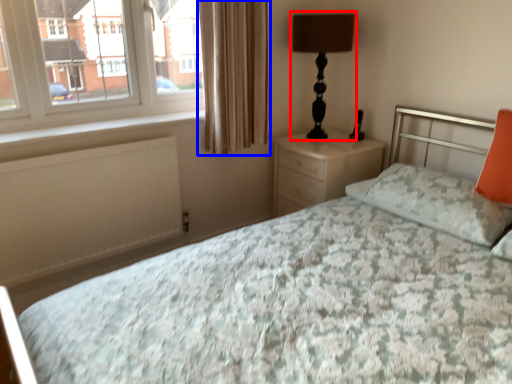
Question: Which object is closer to the camera taking this photo, table lamp (highlighted by a red box) or curtain (highlighted by a blue box)?

Choices:
 (A) table lamp
 (B) curtain

Answer: (B)